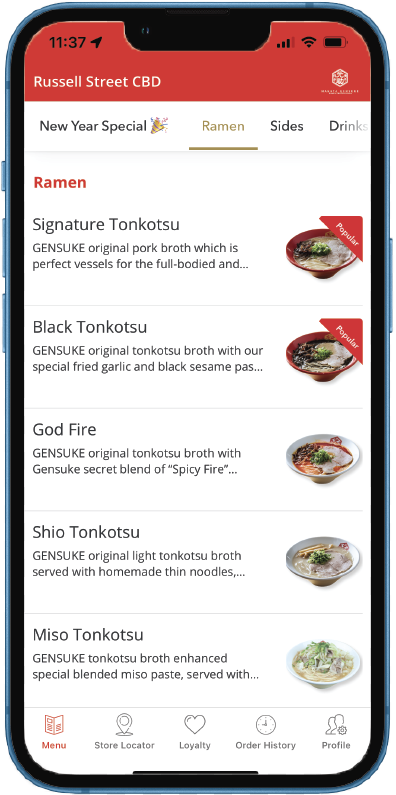
The height and width of the screenshot is (795, 396). I want to click on red bowl, so click(x=330, y=378).